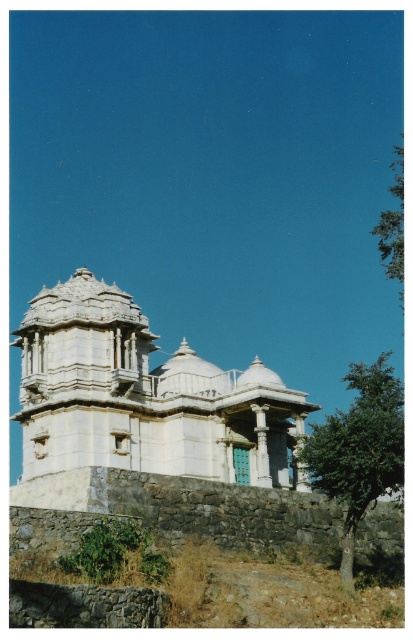
Question: Is white stone palace at center to the left of green leafy tree at upper right from the viewer's perspective?

Choices:
 (A) yes
 (B) no

Answer: (A)

Question: Which object is closer to the camera taking this photo?

Choices:
 (A) green leafy tree at lower right
 (B) white stone palace at center
 (C) green leafy tree at upper right

Answer: (A)

Question: Which point is closer to the camera?

Choices:
 (A) white stone palace at center
 (B) green leafy tree at upper right
 (C) green leafy tree at lower right

Answer: (C)

Question: Which point is closer to the camera?

Choices:
 (A) (118, 444)
 (B) (374, 227)

Answer: (A)

Question: Is green leafy tree at lower right above green leafy tree at upper right?

Choices:
 (A) no
 (B) yes

Answer: (A)

Question: Can you confirm if white stone palace at center is positioned to the right of green leafy tree at lower right?

Choices:
 (A) yes
 (B) no

Answer: (B)